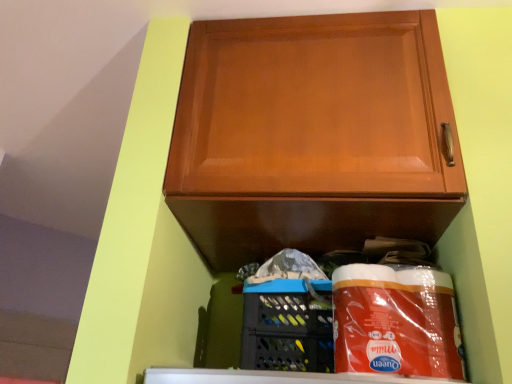
Describe the element at coordinates (312, 135) in the screenshot. I see `glossy wood cabinet at upper center` at that location.

Where is `glossy wood cabinet at upper center`? Image resolution: width=512 pixels, height=384 pixels. glossy wood cabinet at upper center is located at coordinates (312, 135).

What is the approximate height of glossy wood cabinet at upper center?

21.51 inches.

This screenshot has width=512, height=384. What do you see at coordinates (285, 329) in the screenshot?
I see `matte black basket at lower center` at bounding box center [285, 329].

This screenshot has width=512, height=384. Identify the location of matte black basket at lower center. (285, 329).

What is the approximate width of matte black basket at lower center?

7.24 inches.

This screenshot has width=512, height=384. What are the coordinates of `glossy wood cabinet at upper center` in the screenshot? It's located at (312, 135).

Does matte black basket at lower center appear on the right side of glossy wood cabinet at upper center?

In fact, matte black basket at lower center is to the left of glossy wood cabinet at upper center.

Who is more distant, matte black basket at lower center or glossy wood cabinet at upper center?

matte black basket at lower center is further from the camera.

Is point (279, 343) in front of point (183, 127)?

Yes, point (279, 343) is in front of point (183, 127).

From the image's perspective, is matte black basket at lower center located above or below glossy wood cabinet at upper center?

Clearly, from the image's perspective, matte black basket at lower center is below glossy wood cabinet at upper center.

From a real-world perspective, which is physically above, matte black basket at lower center or glossy wood cabinet at upper center?

From a 3D spatial view, glossy wood cabinet at upper center is above.

Based on the photo, between matte black basket at lower center and glossy wood cabinet at upper center, which one has smaller width?

matte black basket at lower center is thinner.

Is matte black basket at lower center shorter than glossy wood cabinet at upper center?

Yes, matte black basket at lower center is shorter than glossy wood cabinet at upper center.

Does matte black basket at lower center have a smaller size compared to glossy wood cabinet at upper center?

Yes, matte black basket at lower center is smaller than glossy wood cabinet at upper center.

Is glossy wood cabinet at upper center completely or partially inside matte black basket at lower center?

No.

Are matte black basket at lower center and glossy wood cabinet at upper center beside each other?

No.

Could you tell me if matte black basket at lower center is facing glossy wood cabinet at upper center?

No, matte black basket at lower center does not turn towards glossy wood cabinet at upper center.

Locate an element on the screen. cabinetry above the matte black basket at lower center (from a real-world perspective) is located at coordinates (312, 135).

Which object is positioned more to the left, glossy wood cabinet at upper center or matte black basket at lower center?

From the viewer's perspective, matte black basket at lower center appears more on the left side.

Considering the relative positions of glossy wood cabinet at upper center and matte black basket at lower center in the image provided, is glossy wood cabinet at upper center behind matte black basket at lower center?

No.

Is point (383, 176) positioned before point (244, 360)?

Yes, it is.

From the image's perspective, is glossy wood cabinet at upper center beneath matte black basket at lower center?

No, from the image's perspective, glossy wood cabinet at upper center is not below matte black basket at lower center.

From a real-world perspective, between glossy wood cabinet at upper center and matte black basket at lower center, who is vertically higher?

glossy wood cabinet at upper center.

Considering the relative sizes of glossy wood cabinet at upper center and matte black basket at lower center in the image provided, is glossy wood cabinet at upper center wider than matte black basket at lower center?

Indeed, glossy wood cabinet at upper center has a greater width compared to matte black basket at lower center.

Consider the image. Considering the sizes of glossy wood cabinet at upper center and matte black basket at lower center in the image, is glossy wood cabinet at upper center taller or shorter than matte black basket at lower center?

Clearly, glossy wood cabinet at upper center is taller compared to matte black basket at lower center.

Who is bigger, glossy wood cabinet at upper center or matte black basket at lower center?

glossy wood cabinet at upper center is bigger.

In the scene shown: Would you say glossy wood cabinet at upper center is inside or outside matte black basket at lower center?

glossy wood cabinet at upper center is outside matte black basket at lower center.

Is glossy wood cabinet at upper center not close to matte black basket at lower center?

Actually, glossy wood cabinet at upper center and matte black basket at lower center are a little close together.

Could you tell me if glossy wood cabinet at upper center is turned towards matte black basket at lower center?

No, glossy wood cabinet at upper center is not oriented towards matte black basket at lower center.

Identify the location of cabinetry above the matte black basket at lower center (from the image's perspective). Image resolution: width=512 pixels, height=384 pixels. (312, 135).

Find the location of `basket on the left side of glossy wood cabinet at upper center`. basket on the left side of glossy wood cabinet at upper center is located at coordinates (285, 329).

Where is `cabinetry above the matte black basket at lower center (from a real-world perspective)`? Image resolution: width=512 pixels, height=384 pixels. cabinetry above the matte black basket at lower center (from a real-world perspective) is located at coordinates (312, 135).